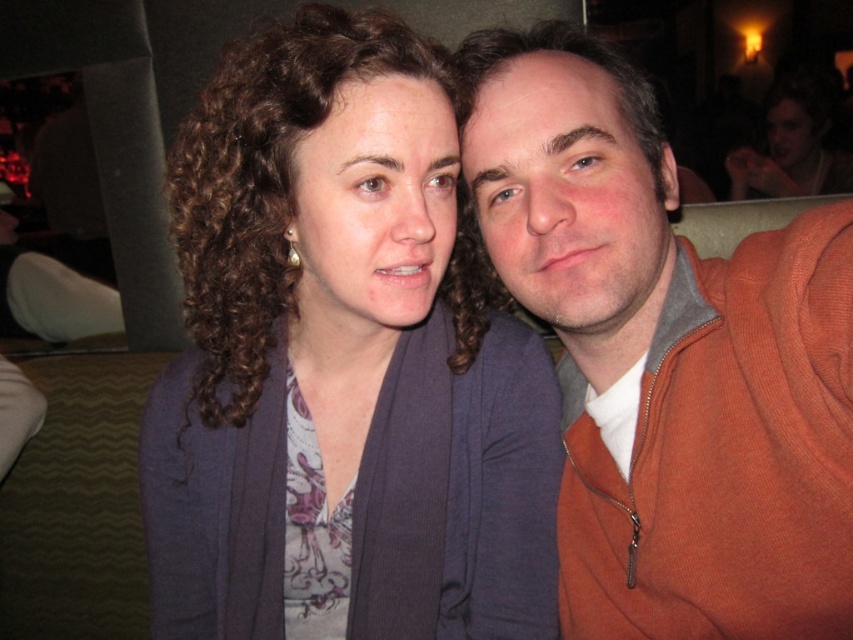
You are a photographer trying to capture the matte blue cardigan at center in your shot. The camera is currently focused at point [341,360]. Is the focus point correctly placed to capture the matte blue cardigan at center?

Yes, the focus point at [341,360] is correctly placed because the Objects Description states that this point corresponds to the matte blue cardigan at center.